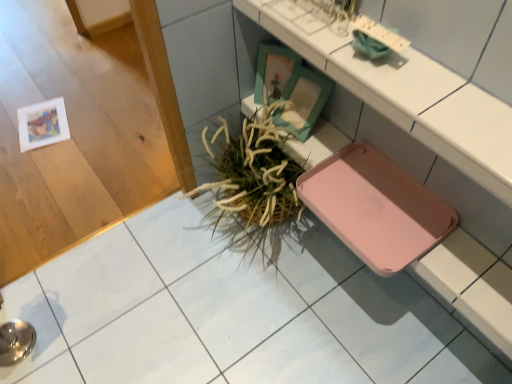
Locate an element on the screen. The image size is (512, 384). free spot above matte white counter at center (from a real-world perspective) is located at coordinates (390, 64).